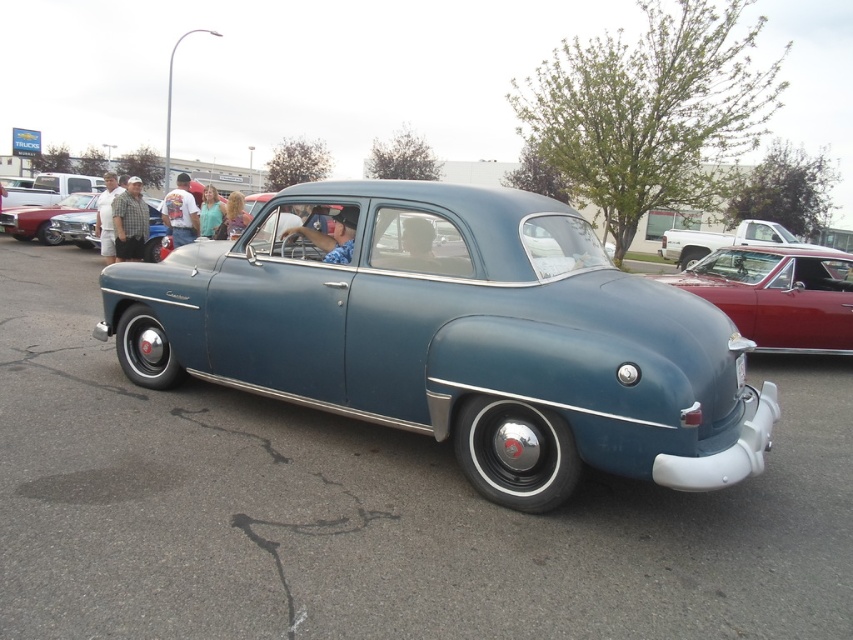
Who is more distant from viewer, [387,337] or [770,224]?

The point [770,224] is more distant.

Is metallic blue car at center closer to camera compared to metallic blue sedan at center?

Yes, it is.

What do you see at coordinates (454, 337) in the screenshot?
I see `metallic blue car at center` at bounding box center [454, 337].

Find the location of a particular element. The image size is (853, 640). metallic blue car at center is located at coordinates (x=454, y=337).

Which is more to the left, glossy red car at right or plaid shirt at left?

plaid shirt at left

Which is behind, point (695, 282) or point (141, 253)?

The point (141, 253) is behind.

Between point (727, 300) and point (117, 218), which one is positioned in front?

Positioned in front is point (727, 300).

At what (x,y) coordinates should I click in order to perform the action: click on glossy red car at right. Please return your answer as a coordinate pair (x, y). Image resolution: width=853 pixels, height=640 pixels. Looking at the image, I should click on (778, 296).

Is metallic blue car at center positioned before denim shirt at center?

Yes, metallic blue car at center is in front of denim shirt at center.

Who is more forward, (x=148, y=284) or (x=206, y=234)?

Positioned in front is point (x=148, y=284).

Find the location of a particular element. This screenshot has height=640, width=853. metallic blue car at center is located at coordinates (454, 337).